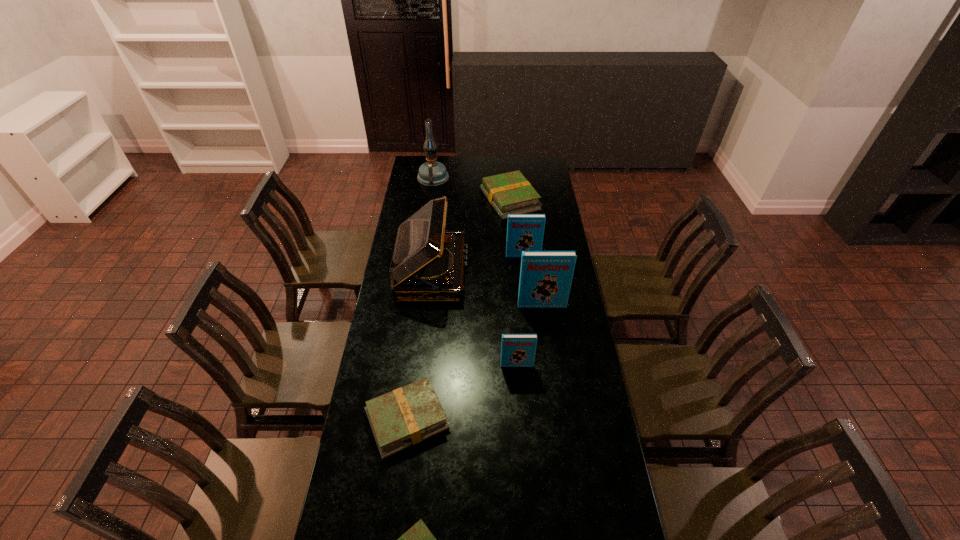
At what (x,y) coordinates should I click in order to perform the action: click on oil lamp present at the left edge. Please return your answer as a coordinate pair (x, y). The height and width of the screenshot is (540, 960). Looking at the image, I should click on (432, 173).

The height and width of the screenshot is (540, 960). What are the coordinates of `record player that is positioned at the left edge` in the screenshot? It's located at (427, 265).

This screenshot has height=540, width=960. What are the coordinates of `book located at the left edge` in the screenshot? It's located at (408, 415).

You are a GUI agent. You are given a task and a screenshot of the screen. Output one action in this format:
    pyautogui.click(x=<x>, y=<y>)
    Task: Click on the object located in the far left corner section of the desktop
    The width and height of the screenshot is (960, 540).
    Given the screenshot: What is the action you would take?
    pyautogui.click(x=432, y=173)

I want to click on free space at the far edge, so click(x=517, y=164).

Identify the location of free space at the right edge. The width and height of the screenshot is (960, 540). (560, 227).

Identify the location of free space between the tallest book and the oil lamp. Image resolution: width=960 pixels, height=540 pixels. (488, 242).

Locate an element on the screen. The width and height of the screenshot is (960, 540). free space between the record player and the biggest blue book is located at coordinates (487, 289).

Find the location of a particular element. object that ranks as the second closest to the oil lamp is located at coordinates (427, 265).

The width and height of the screenshot is (960, 540). Find the location of `object that is the fifth nearest to the oil lamp`. object that is the fifth nearest to the oil lamp is located at coordinates (517, 350).